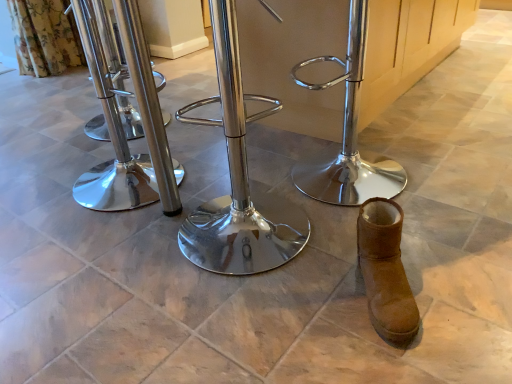
The image size is (512, 384). What are the coordinates of `vacant space to the right of polished metal swivel chair at center, marked as the 3th swivel chair in a right-to-left arrangement` in the screenshot? It's located at pos(218,169).